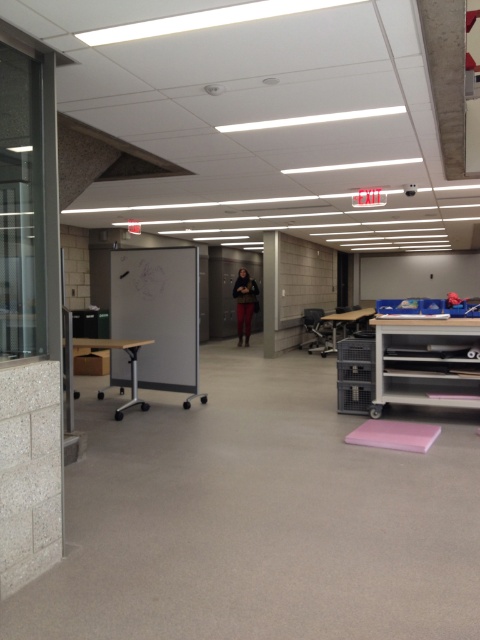
Is point (388, 432) positioned after point (264, 257)?

No, it is not.

Is pink foam yoga mat at lower center to the right of white concrete pillar at center from the viewer's perspective?

Correct, you'll find pink foam yoga mat at lower center to the right of white concrete pillar at center.

This screenshot has height=640, width=480. I want to click on pink foam yoga mat at lower center, so click(395, 435).

Find the location of a particular element. This screenshot has width=480, height=640. pink foam yoga mat at lower center is located at coordinates (395, 435).